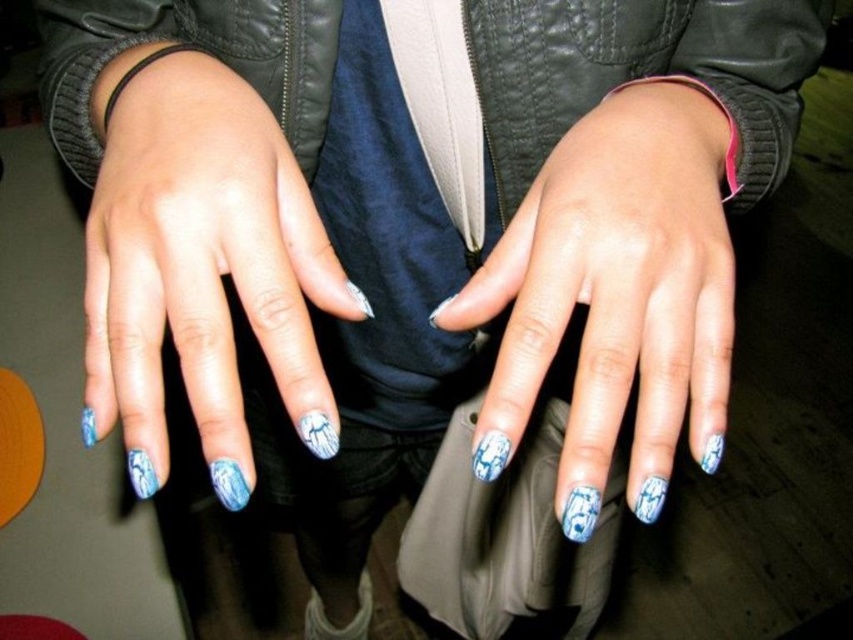
Does blue marble nails at center have a greater width compared to blue painted nails at center?

Yes, blue marble nails at center is wider than blue painted nails at center.

Is blue marble nails at center above blue painted nails at center?

Correct, blue marble nails at center is located above blue painted nails at center.

Between point (142, 97) and point (578, 124), which one is positioned behind?

Point (578, 124)

Find the location of a particular element. blue marble nails at center is located at coordinates (200, 266).